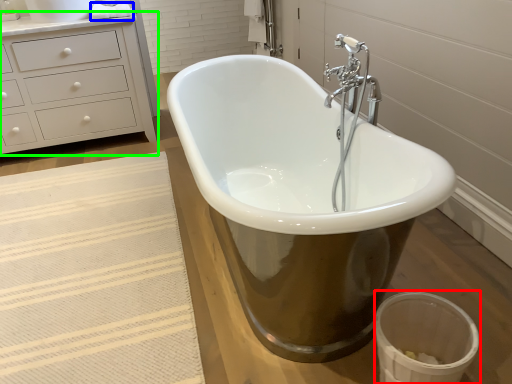
Question: Which object is positioned closest to toilet bowl (highlighted by a red box)? Select from toilet paper (highlighted by a blue box) and chest of drawers (highlighted by a green box).

Choices:
 (A) toilet paper
 (B) chest of drawers

Answer: (B)